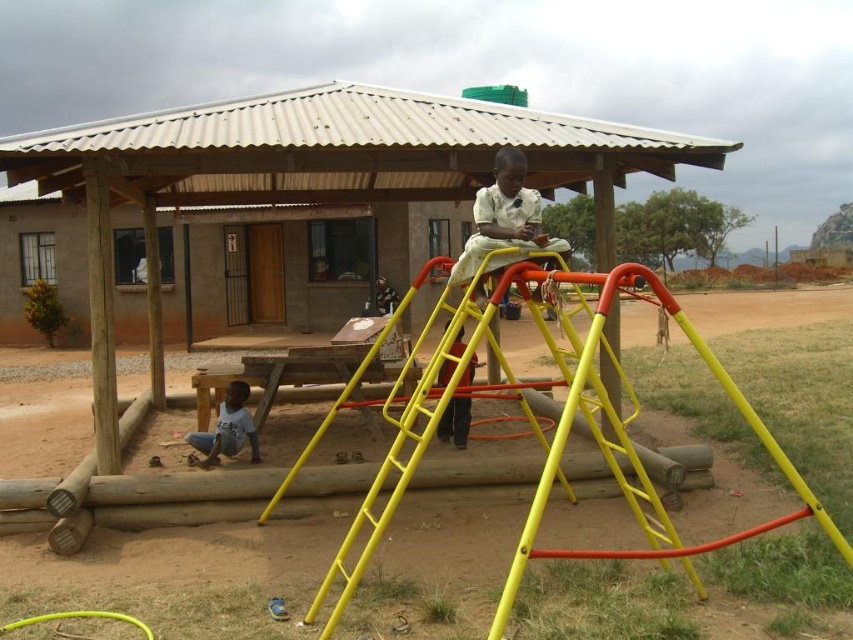
Is the position of white cotton shirt at center less distant than that of light blue cotton shirt at lower left?

Yes, white cotton shirt at center is closer to the viewer.

Is point (525, 202) less distant than point (236, 435)?

That is True.

Find the location of a particular element. This screenshot has height=640, width=853. white cotton shirt at center is located at coordinates (503, 218).

Does point (628, 275) come closer to viewer compared to point (538, 236)?

Yes, it is.

Is yellow metal ladder at center closer to the viewer compared to white cotton shirt at center?

Yes, yellow metal ladder at center is in front of white cotton shirt at center.

Who is more distant from viewer, (350, 588) or (494, 227)?

Positioned behind is point (494, 227).

Find the location of a particular element. This screenshot has width=853, height=640. yellow metal ladder at center is located at coordinates (532, 428).

Does yellow metal ladder at center have a lesser width compared to light blue cotton shirt at lower left?

Yes.

Does yellow metal ladder at center have a larger size compared to light blue cotton shirt at lower left?

No, yellow metal ladder at center is not bigger than light blue cotton shirt at lower left.

What do you see at coordinates (532, 428) in the screenshot? The width and height of the screenshot is (853, 640). I see `yellow metal ladder at center` at bounding box center [532, 428].

Where is `yellow metal ladder at center`? This screenshot has width=853, height=640. yellow metal ladder at center is located at coordinates (532, 428).